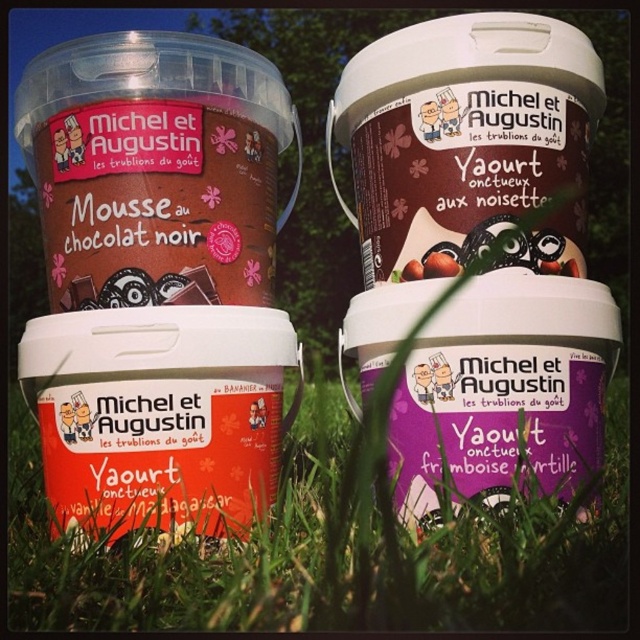
Question: Which point is farther to the camera?

Choices:
 (A) (534, 252)
 (B) (332, 474)
 (C) (554, 120)

Answer: (B)

Question: Which point appears farthest from the camera in this image?

Choices:
 (A) (422, 180)
 (B) (545, 257)
 (C) (218, 561)

Answer: (A)

Question: Is purple matte yogurt at center below green grass at lower center?

Choices:
 (A) no
 (B) yes

Answer: (A)

Question: In this image, where is purple matte yogurt at center located relative to matte chocolate spread at center?

Choices:
 (A) left
 (B) right

Answer: (A)

Question: Is purple matte yogurt at center positioned at the back of green grass at lower center?

Choices:
 (A) yes
 (B) no

Answer: (A)

Question: Which object appears closest to the camera in this image?

Choices:
 (A) green grass at lower center
 (B) matte chocolate spread at center

Answer: (A)